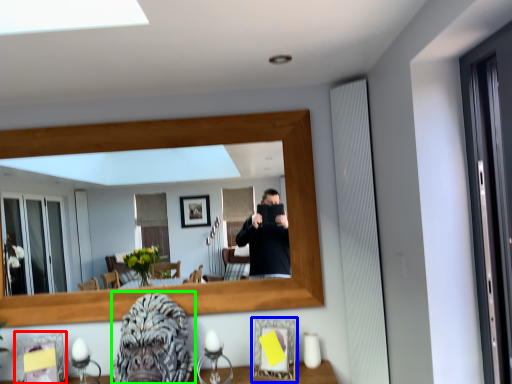
Question: Which object is positioned farthest from picture frame (highlighted by a red box)? Select from picture frame (highlighted by a blue box) and gorilla (highlighted by a green box).

Choices:
 (A) picture frame
 (B) gorilla

Answer: (A)